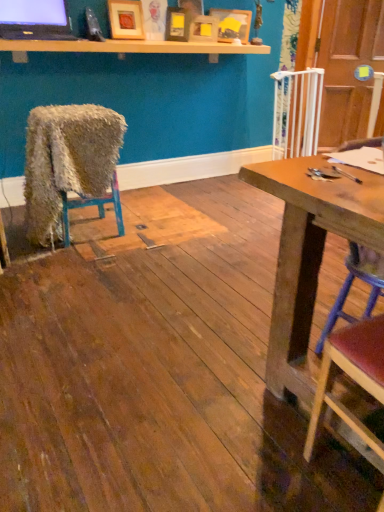
Question: Is fuzzy fabric chair at left, which appears as the first chair when viewed from the back, bigger than light wood shelf at upper center?

Choices:
 (A) yes
 (B) no

Answer: (A)

Question: Is fuzzy fabric chair at left, which is the first chair in left-to-right order, to the left of light wood shelf at upper center from the viewer's perspective?

Choices:
 (A) no
 (B) yes

Answer: (B)

Question: Could you tell me if fuzzy fabric chair at left, which is the first chair in left-to-right order, is facing light wood shelf at upper center?

Choices:
 (A) no
 (B) yes

Answer: (A)

Question: Can we say fuzzy fabric chair at left, which is the first chair in left-to-right order, lies outside light wood shelf at upper center?

Choices:
 (A) yes
 (B) no

Answer: (A)

Question: Does fuzzy fabric chair at left, which is counted as the 3th chair, starting from the front, have a lesser height compared to light wood shelf at upper center?

Choices:
 (A) no
 (B) yes

Answer: (A)

Question: Is fuzzy fabric chair at left, which is counted as the 3th chair, starting from the front, to the right of light wood shelf at upper center from the viewer's perspective?

Choices:
 (A) no
 (B) yes

Answer: (A)

Question: Is wooden picture frame at upper center, the second picture frame from the right, at the right side of wooden picture frame at upper center, arranged as the 1th picture frame when viewed from the right?

Choices:
 (A) yes
 (B) no

Answer: (B)

Question: From a real-world perspective, is wooden picture frame at upper center, the second picture frame from the right, on wooden picture frame at upper center, which is counted as the 4th picture frame, starting from the left?

Choices:
 (A) no
 (B) yes

Answer: (A)

Question: From the image's perspective, is wooden picture frame at upper center, arranged as the third picture frame when viewed from the left, located beneath wooden picture frame at upper center, arranged as the 1th picture frame when viewed from the right?

Choices:
 (A) no
 (B) yes

Answer: (B)

Question: Can you confirm if wooden picture frame at upper center, the second picture frame from the right, is taller than wooden picture frame at upper center, arranged as the 1th picture frame when viewed from the right?

Choices:
 (A) yes
 (B) no

Answer: (B)

Question: Considering the relative sizes of wooden picture frame at upper center, the second picture frame from the right, and wooden picture frame at upper center, arranged as the 1th picture frame when viewed from the right, in the image provided, is wooden picture frame at upper center, the second picture frame from the right, bigger than wooden picture frame at upper center, arranged as the 1th picture frame when viewed from the right,?

Choices:
 (A) no
 (B) yes

Answer: (A)

Question: Can we say wooden picture frame at upper center, the second picture frame from the right, lies outside wooden picture frame at upper center, which is counted as the 4th picture frame, starting from the left?

Choices:
 (A) no
 (B) yes

Answer: (B)

Question: Is the depth of light wood shelf at upper center greater than that of wooden picture frame at upper center, which is counted as the 4th picture frame, starting from the left?

Choices:
 (A) yes
 (B) no

Answer: (B)